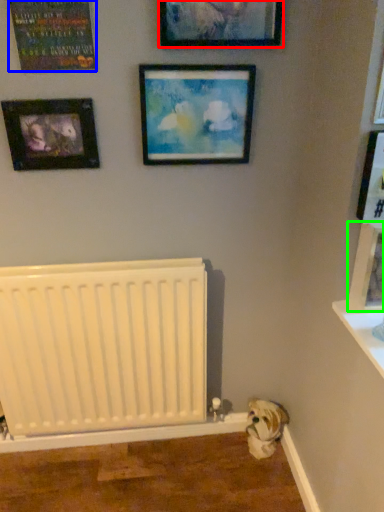
Question: Based on their relative distances, which object is nearer to picture frame (highlighted by a red box)? Choose from picture frame (highlighted by a blue box) and picture frame (highlighted by a green box).

Choices:
 (A) picture frame
 (B) picture frame

Answer: (A)